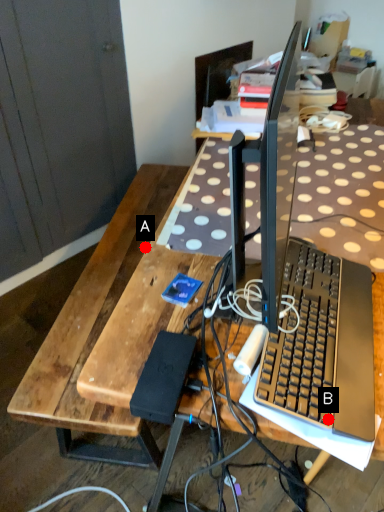
Question: Two points are circled on the image, labeled by A and B beside each circle. Which point is farther to the camera?

Choices:
 (A) A is further
 (B) B is further

Answer: (A)